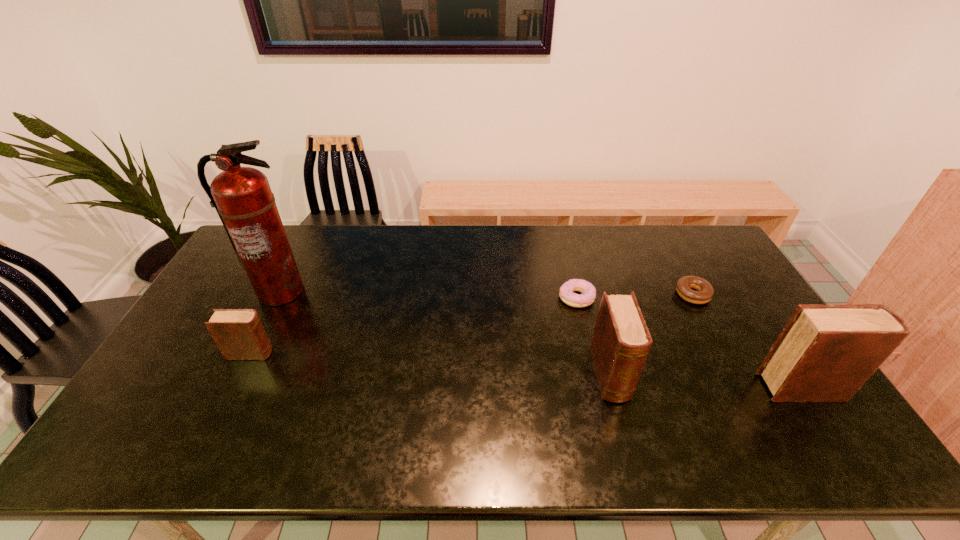
Find the location of a particular element. The height and width of the screenshot is (540, 960). the leftmost diary is located at coordinates (239, 334).

Locate an element on the screen. the fourth tallest object is located at coordinates (239, 334).

The height and width of the screenshot is (540, 960). Identify the location of the second diary from left to right. (621, 342).

Image resolution: width=960 pixels, height=540 pixels. I want to click on the second shortest diary, so click(621, 342).

The image size is (960, 540). I want to click on the rightmost diary, so click(825, 353).

Find the location of a particular element. The width and height of the screenshot is (960, 540). the right doughnut is located at coordinates (705, 292).

The image size is (960, 540). What are the coordinates of `the left doughnut` in the screenshot? It's located at (588, 291).

Where is `the tallest object`? The image size is (960, 540). the tallest object is located at coordinates (242, 197).

You are a GUI agent. You are given a task and a screenshot of the screen. Output one action in this format:
    pyautogui.click(x=<x>, y=<y>)
    Task: Click on the vacant space situated on the spine side of the leftmost diary
    The height and width of the screenshot is (540, 960).
    Given the screenshot: What is the action you would take?
    pyautogui.click(x=308, y=353)

In order to click on vacant space located on the back of the right doughnut in this screenshot , I will do `click(682, 273)`.